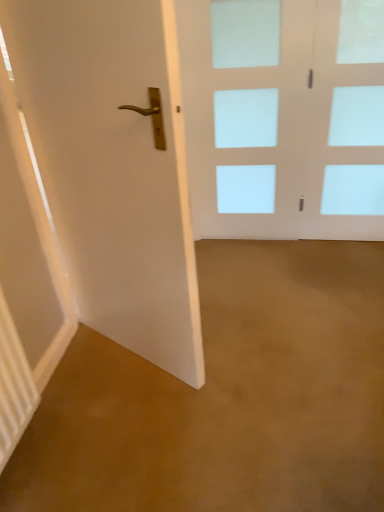
Question: Considering the relative sizes of clear glass door at upper right and white glossy door at left, which is the second door from back to front, in the image provided, is clear glass door at upper right bigger than white glossy door at left, which is the second door from back to front,?

Choices:
 (A) yes
 (B) no

Answer: (B)

Question: Is clear glass door at upper right further to camera compared to white glossy door at left, which is the 2th door from right to left?

Choices:
 (A) yes
 (B) no

Answer: (A)

Question: Is clear glass door at upper right thinner than white glossy door at left, positioned as the 1th door in left-to-right order?

Choices:
 (A) no
 (B) yes

Answer: (B)

Question: From the image's perspective, would you say clear glass door at upper right is shown under white glossy door at left, positioned as the 1th door in left-to-right order?

Choices:
 (A) no
 (B) yes

Answer: (A)

Question: Is the depth of clear glass door at upper right less than that of white glossy door at left, positioned as the 1th door in left-to-right order?

Choices:
 (A) no
 (B) yes

Answer: (A)

Question: Is white glass door at center, the 1th door positioned from the back, to the left or to the right of clear glass door at upper right in the image?

Choices:
 (A) right
 (B) left

Answer: (B)

Question: From their relative heights in the image, would you say white glass door at center, the 1th door positioned from the back, is taller or shorter than clear glass door at upper right?

Choices:
 (A) tall
 (B) short

Answer: (A)

Question: Considering their positions, is white glass door at center, marked as the second door in a front-to-back arrangement, located in front of or behind clear glass door at upper right?

Choices:
 (A) behind
 (B) front

Answer: (A)

Question: Considering the positions of point (233, 208) and point (347, 125), is point (233, 208) closer or farther from the camera than point (347, 125)?

Choices:
 (A) farther
 (B) closer

Answer: (A)

Question: Based on their positions, is white glossy door at left, which is the first door from front to back, located to the left or right of clear glass door at upper right?

Choices:
 (A) left
 (B) right

Answer: (A)

Question: Considering their positions, is white glossy door at left, which is the second door from back to front, located in front of or behind clear glass door at upper right?

Choices:
 (A) front
 (B) behind

Answer: (A)

Question: In terms of size, does white glossy door at left, which is the second door from back to front, appear bigger or smaller than clear glass door at upper right?

Choices:
 (A) small
 (B) big

Answer: (B)

Question: Considering the positions of point tap(129, 287) and point tap(337, 22), is point tap(129, 287) closer or farther from the camera than point tap(337, 22)?

Choices:
 (A) farther
 (B) closer

Answer: (B)

Question: Relative to white glass door at center, which is the 1th door in right-to-left order, is clear glass door at upper right in front or behind?

Choices:
 (A) behind
 (B) front

Answer: (B)

Question: Does point (375, 154) appear closer or farther from the camera than point (196, 190)?

Choices:
 (A) farther
 (B) closer

Answer: (B)